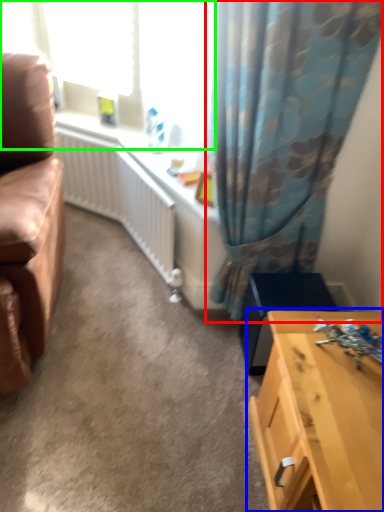
Question: Which object is the farthest from curtain (highlighted by a red box)? Choose among these: table (highlighted by a blue box) or window screen (highlighted by a green box).

Choices:
 (A) table
 (B) window screen

Answer: (A)